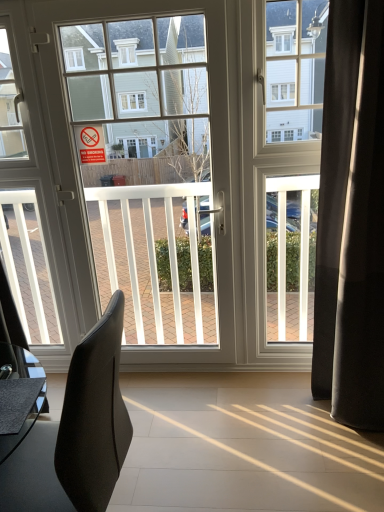
Question: In the image, is red paper sign at upper left on the left side or the right side of black leather chair at left?

Choices:
 (A) right
 (B) left

Answer: (B)

Question: From a real-world perspective, relative to black leather chair at left, is red paper sign at upper left vertically above or below?

Choices:
 (A) above
 (B) below

Answer: (A)

Question: Based on their relative distances, which object is nearer to the black fabric curtain at right?

Choices:
 (A) white glossy door at center
 (B) red paper sign at upper left
 (C) black leather chair at left

Answer: (A)

Question: Which of these objects is positioned farthest from the white glossy door at center?

Choices:
 (A) red paper sign at upper left
 (B) black fabric curtain at right
 (C) black leather chair at left

Answer: (C)